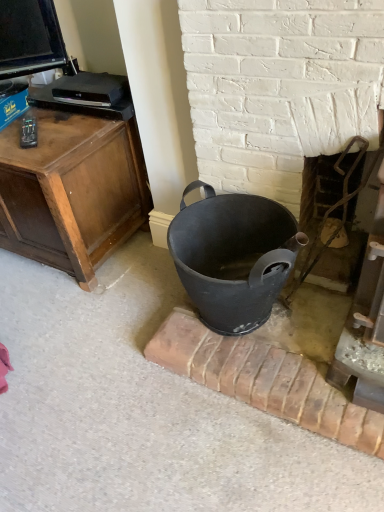
Locate an element on the screen. This screenshot has width=384, height=512. vacant space that's between matte black trash can at center and rustic metal fireplace at right, acting as the first fireplace starting from the right is located at coordinates (313, 337).